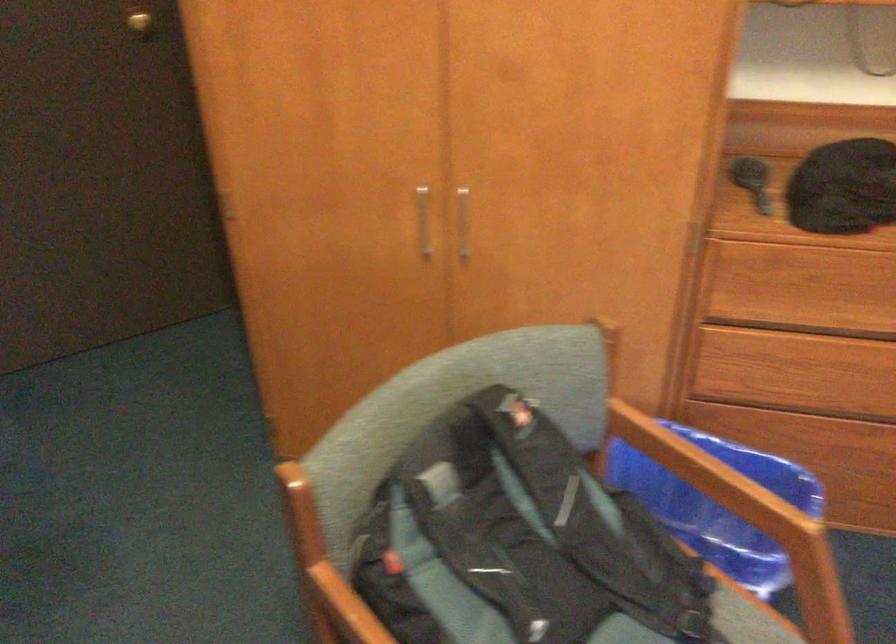
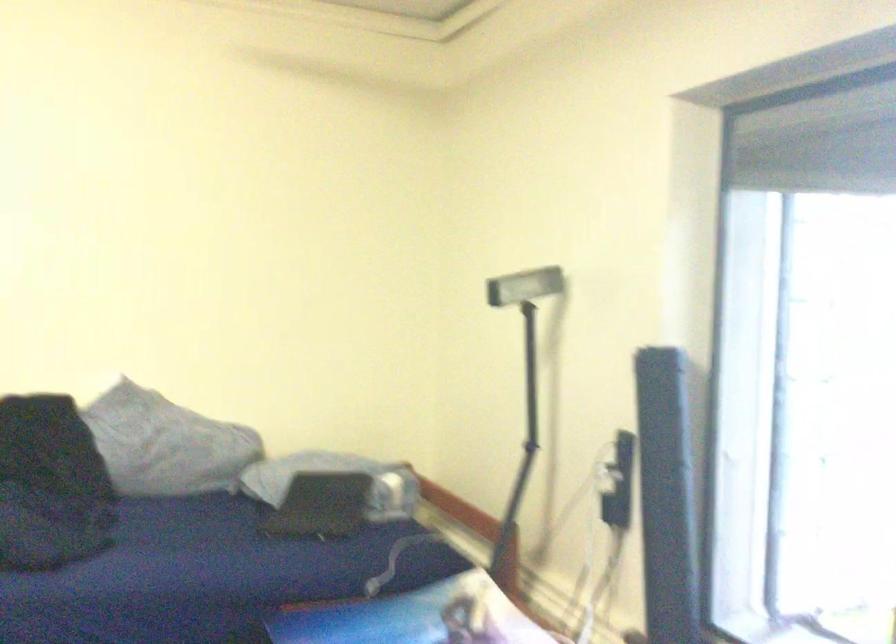
Question: The images are taken continuously from a first-person perspective. In which direction is your viewpoint rotating?

Choices:
 (A) Left
 (B) Right
 (C) Up
 (D) Down

Answer: (B)